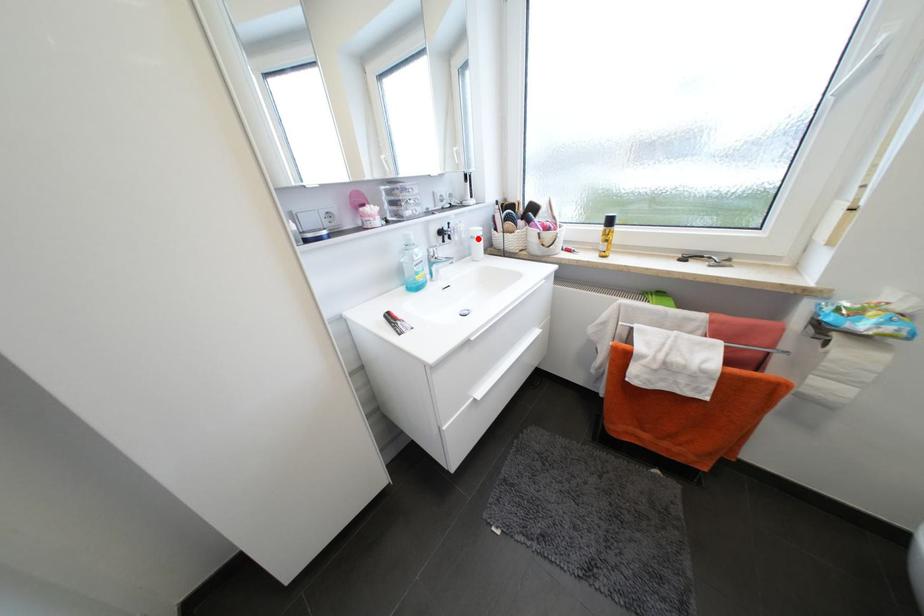
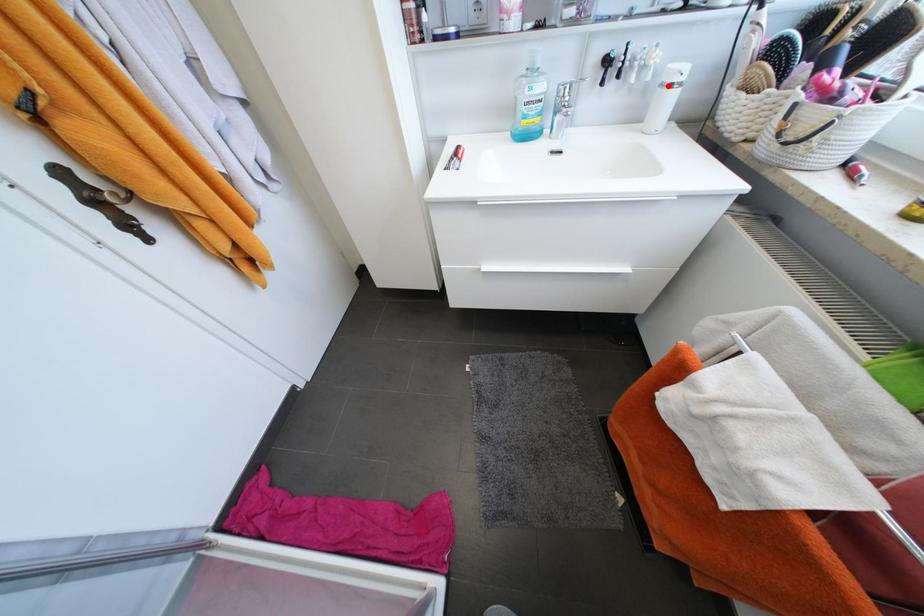
I am providing you with two images of the same scene from different viewpoints. A red point is marked on the first image and another point is marked on the second image. Are the points marked in image1 and image2 representing the same 3D position?

Yes